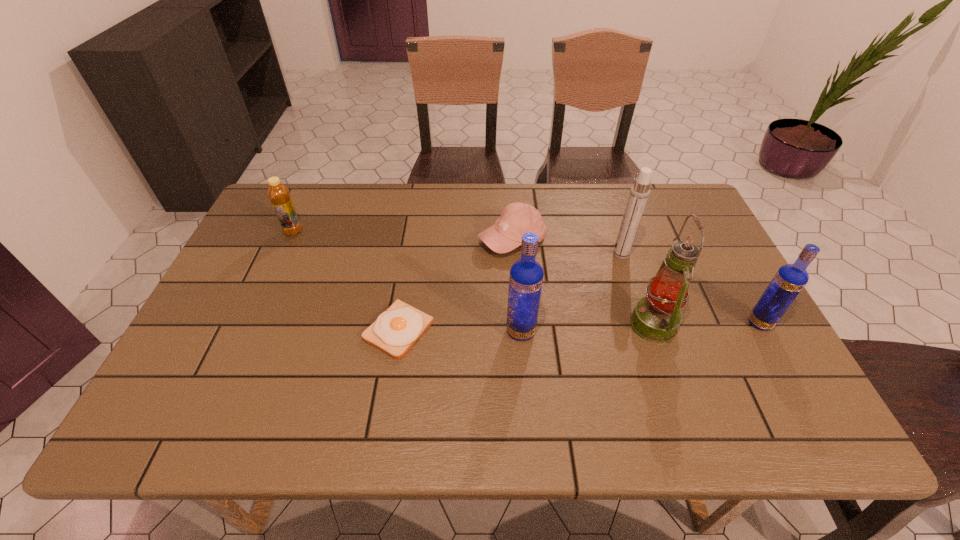
Identify the location of free space between the leftmost object and the aerosol can. (457, 243).

I want to click on free point between the aerosol can and the baseball cap, so click(566, 247).

You are a GUI agent. You are given a task and a screenshot of the screen. Output one action in this format:
    pyautogui.click(x=<x>, y=<y>)
    Task: Click on the free space between the bottle and the aerosol can
    
    Given the screenshot: What is the action you would take?
    pyautogui.click(x=457, y=243)

The height and width of the screenshot is (540, 960). I want to click on free space between the third shortest object and the oil lamp, so coord(473,278).

Where is `vacant area that lies between the bottle and the sixth object from right to left`? This screenshot has width=960, height=540. vacant area that lies between the bottle and the sixth object from right to left is located at coordinates (346, 281).

Locate which object is the fifth closest to the aerosol can. Please provide its 2D coordinates. Your answer should be formatted as a tuple, i.e. [(x, y)], where the tuple contains the x and y coordinates of a point satisfying the conditions above.

[(396, 330)]

Identify which object is the third nearest to the sixth object from right to left. Please provide its 2D coordinates. Your answer should be formatted as a tuple, i.e. [(x, y)], where the tuple contains the x and y coordinates of a point satisfying the conditions above.

[(279, 195)]

Image resolution: width=960 pixels, height=540 pixels. Identify the location of vacant region that satisfies the following two spatial constraints: 1. on the front-facing side of the oil lamp; 2. on the left side of the baseball cap. (518, 325).

Where is `vacant space that satisfies the following two spatial constraints: 1. on the front side of the third shortest object; 2. on the right side of the sixth object from right to left`? vacant space that satisfies the following two spatial constraints: 1. on the front side of the third shortest object; 2. on the right side of the sixth object from right to left is located at coordinates (249, 330).

Identify the location of vacant point that satisfies the following two spatial constraints: 1. on the front side of the bottle; 2. on the right side of the oil lamp. This screenshot has height=540, width=960. (251, 325).